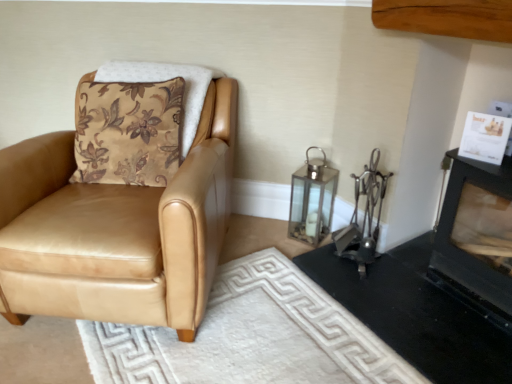
What are the coordinates of `vacant point to the left of clear glass lantern at center-right` in the screenshot? It's located at click(x=267, y=234).